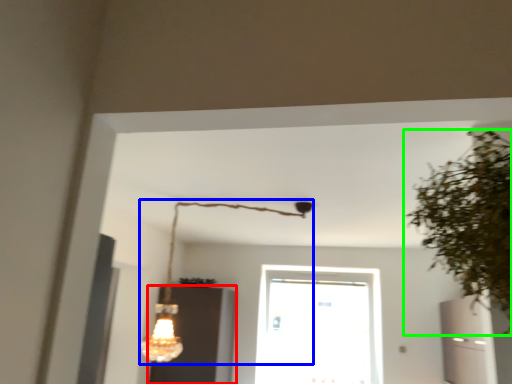
Question: Which object is positioned farthest from cabinetry (highlighted by a red box)? Select from lamp (highlighted by a blue box) and houseplant (highlighted by a green box).

Choices:
 (A) lamp
 (B) houseplant

Answer: (B)